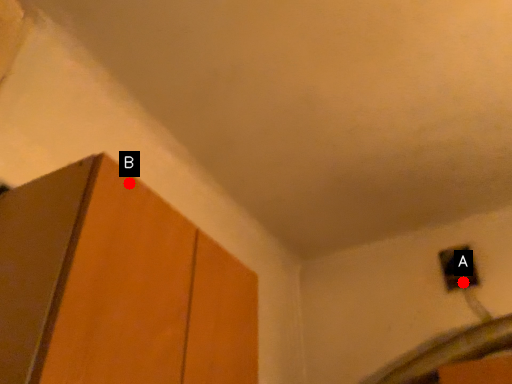
Question: Two points are circled on the image, labeled by A and B beside each circle. Which point is further to the camera?

Choices:
 (A) A is further
 (B) B is further

Answer: (A)